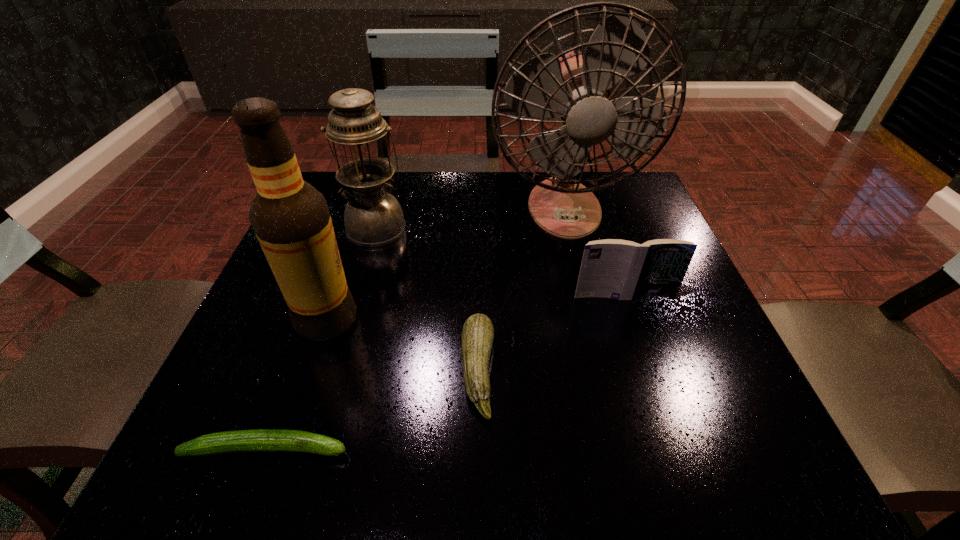
This screenshot has height=540, width=960. In order to click on vacant space situated on the front of the oil lamp in this screenshot , I will do `click(334, 375)`.

Where is `free spot located 0.300m on the front cover of the fourth tallest object`? free spot located 0.300m on the front cover of the fourth tallest object is located at coordinates (677, 453).

In order to click on vacant space situated 0.310m at the stem end of the second shortest object in this screenshot , I will do `click(683, 371)`.

Identify the location of blank space located on the front-facing side of the nearest object. (483, 449).

Find the location of a particular element. The height and width of the screenshot is (540, 960). fan that is at the far edge is located at coordinates (577, 89).

At what (x,y) coordinates should I click in order to perform the action: click on oil lamp located at the far edge. Please return your answer as a coordinate pair (x, y). The height and width of the screenshot is (540, 960). Looking at the image, I should click on (373, 217).

Identify the location of alcohol that is at the left edge. (291, 220).

Locate an element on the screen. The image size is (960, 540). oil lamp that is at the left edge is located at coordinates (373, 217).

You are a GUI agent. You are given a task and a screenshot of the screen. Output one action in this format:
    pyautogui.click(x=<x>, y=<y>)
    Task: Click on the zucchini that is at the left edge
    
    Given the screenshot: What is the action you would take?
    pyautogui.click(x=260, y=440)

Find the location of a particular element. The width and height of the screenshot is (960, 540). fan located at the right edge is located at coordinates (577, 89).